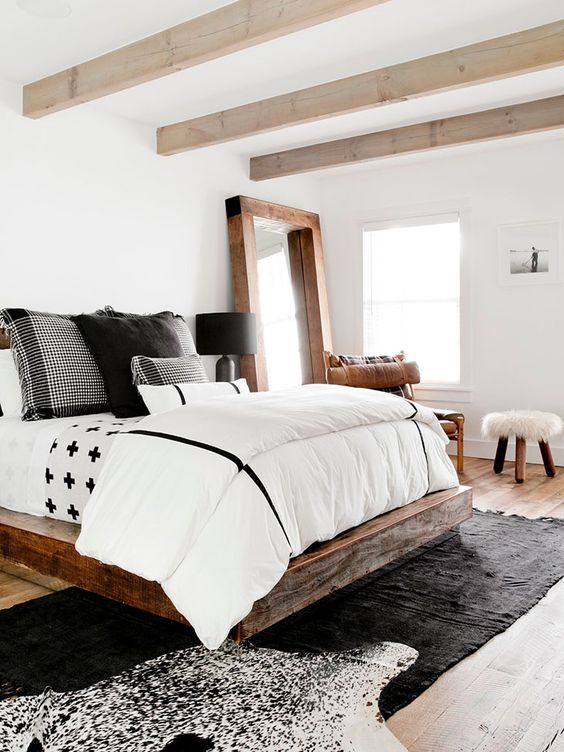
Locate an element on the screen. chair legs is located at coordinates (522, 462).